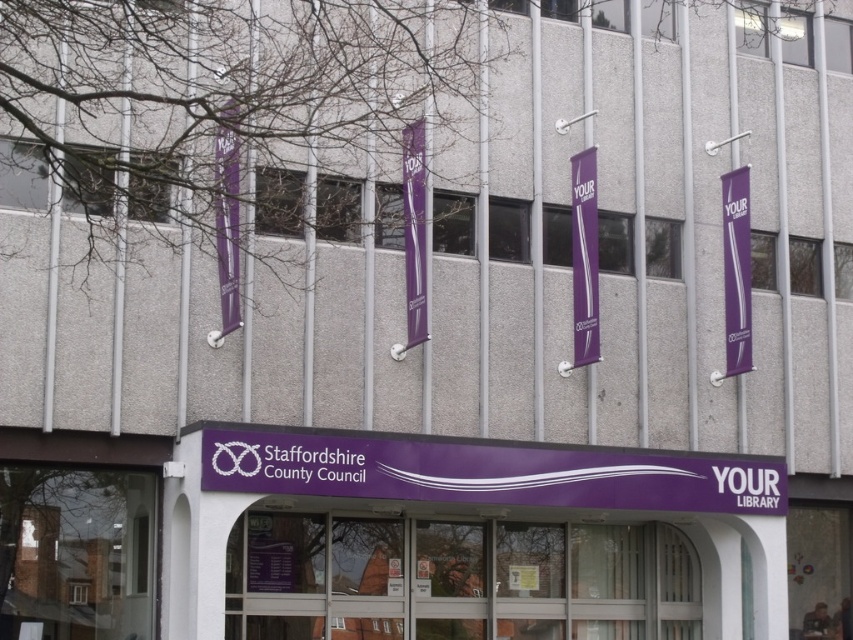
Can you confirm if purple matte signboard at center is positioned to the right of purple fabric banner at center?

In fact, purple matte signboard at center is to the left of purple fabric banner at center.

Does purple matte signboard at center appear over purple fabric banner at center?

Incorrect, purple matte signboard at center is not positioned above purple fabric banner at center.

Describe the element at coordinates (463, 538) in the screenshot. I see `purple matte signboard at center` at that location.

Locate an element on the screen. The width and height of the screenshot is (853, 640). purple matte signboard at center is located at coordinates (463, 538).

Does purple fabric banner at right appear on the left side of purple fabric banner at center?

No, purple fabric banner at right is not to the left of purple fabric banner at center.

Can you confirm if purple fabric banner at right is thinner than purple fabric banner at center?

Incorrect, purple fabric banner at right's width is not less than purple fabric banner at center's.

Where is `purple fabric banner at right`? The height and width of the screenshot is (640, 853). purple fabric banner at right is located at coordinates (735, 269).

Find the location of `purple fabric banner at right`. purple fabric banner at right is located at coordinates pos(735,269).

Who is higher up, purple matte signboard at center or purple fabric banner at right?

Positioned higher is purple fabric banner at right.

Between point (297, 456) and point (741, 333), which one is positioned behind?

The point (741, 333) is behind.

You are a GUI agent. You are given a task and a screenshot of the screen. Output one action in this format:
    pyautogui.click(x=<x>, y=<y>)
    Task: Click on the purple matte signboard at center
    This screenshot has height=640, width=853.
    Given the screenshot: What is the action you would take?
    pyautogui.click(x=463, y=538)